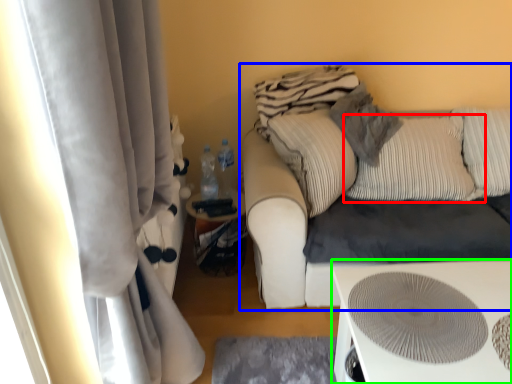
Question: Which object is the farthest from pillow (highlighted by a red box)? Choose among these: studio couch (highlighted by a blue box) or table (highlighted by a green box).

Choices:
 (A) studio couch
 (B) table

Answer: (B)